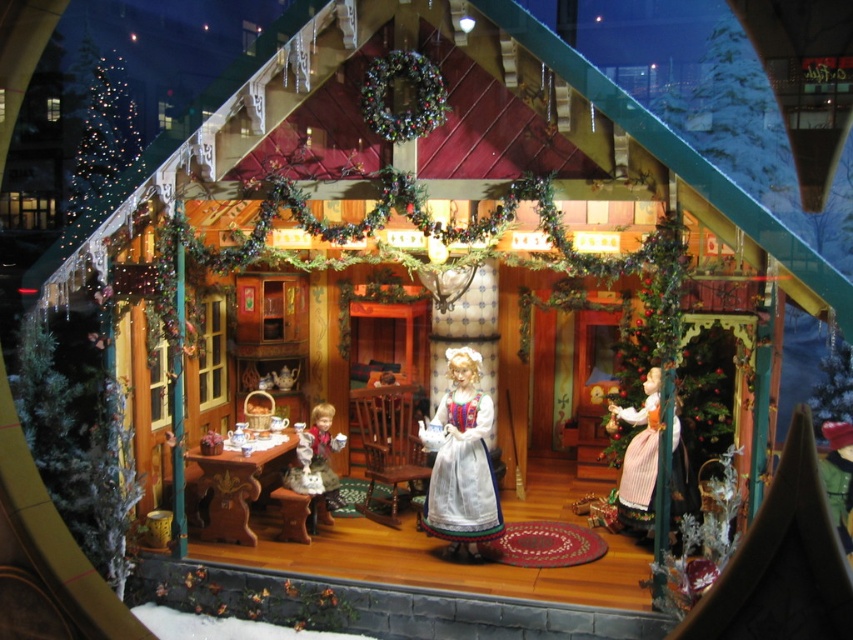
Question: Is white porcelain doll at center positioned in front of porcelain doll at lower left?

Choices:
 (A) yes
 (B) no

Answer: (A)

Question: Is white porcelain doll at center positioned before matte white porcelain doll at right?

Choices:
 (A) no
 (B) yes

Answer: (A)

Question: Is white porcelain doll at center above porcelain doll at lower left?

Choices:
 (A) no
 (B) yes

Answer: (B)

Question: Estimate the real-world distances between objects in this image. Which object is farther from the matte white porcelain doll at right?

Choices:
 (A) white porcelain doll at center
 (B) porcelain doll at lower left

Answer: (B)

Question: Which of the following is the closest to the observer?

Choices:
 (A) porcelain doll at lower left
 (B) white porcelain doll at center
 (C) matte white porcelain doll at right

Answer: (C)

Question: Which point is farther to the camera?

Choices:
 (A) white porcelain doll at center
 (B) porcelain doll at lower left

Answer: (B)